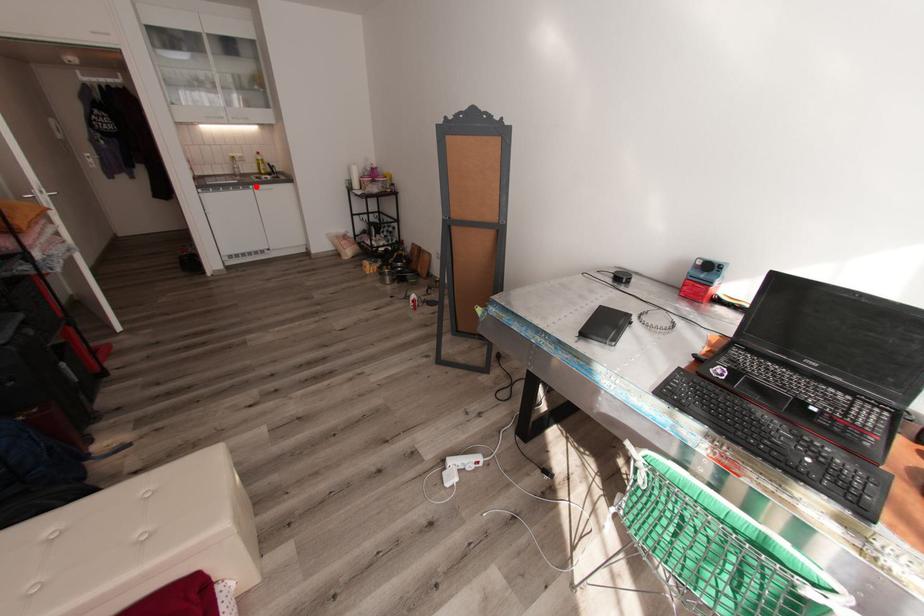
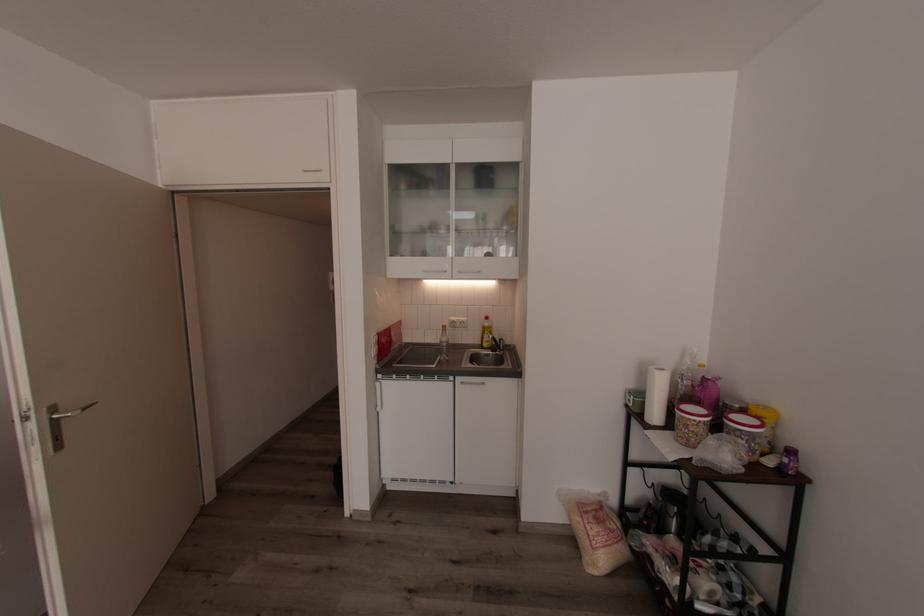
Find the pixel in the second image that matches the highlighted location in the first image.

(456, 378)